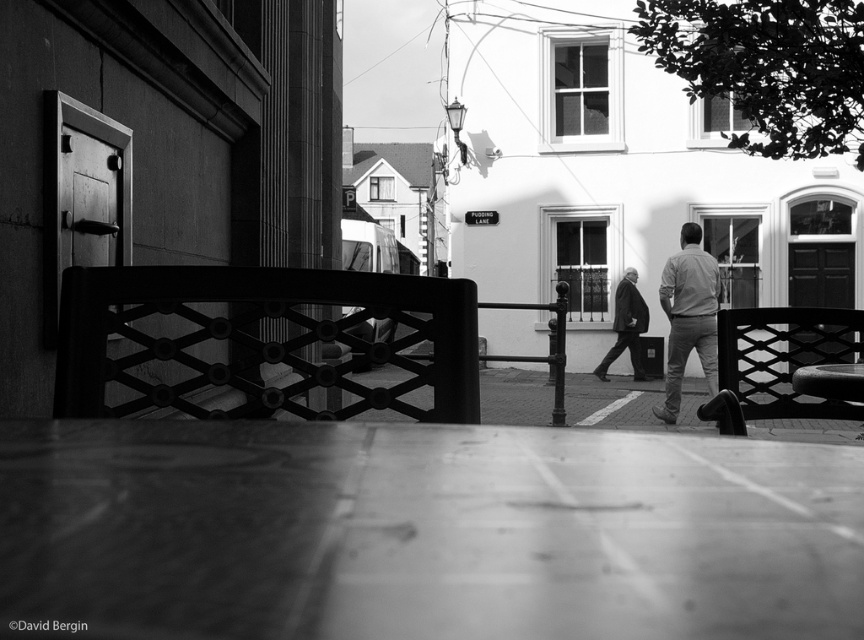
You are standing at the point marked by the coordinate point (422,532) in the image. What type of surface are you standing on?

The point (422,532) corresponds to smooth concrete pavement at center, so you are standing on smooth concrete pavement at center.

You are standing at the camera position in the image and want to reach both points, point(575, 490) and point(678, 301). Which point will you reach first?

You will reach point(575, 490) first because it is closer to the camera than point(678, 301).

Based on the scene described, what is the significance of the point labeled as point (422, 532)?

The point labeled as point (422, 532) represents the smooth concrete pavement at center.